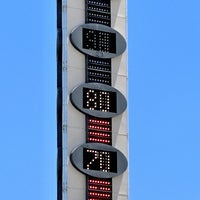
Find the location of `red lights`. red lights is located at coordinates (98, 131), (99, 189).